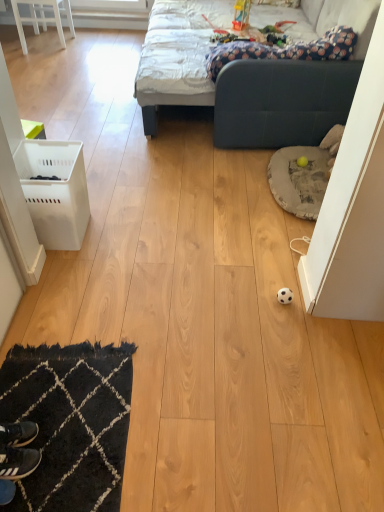
Where is `vacant area that is in front of black leather shoe at lower left`? Image resolution: width=384 pixels, height=512 pixels. vacant area that is in front of black leather shoe at lower left is located at coordinates (26, 479).